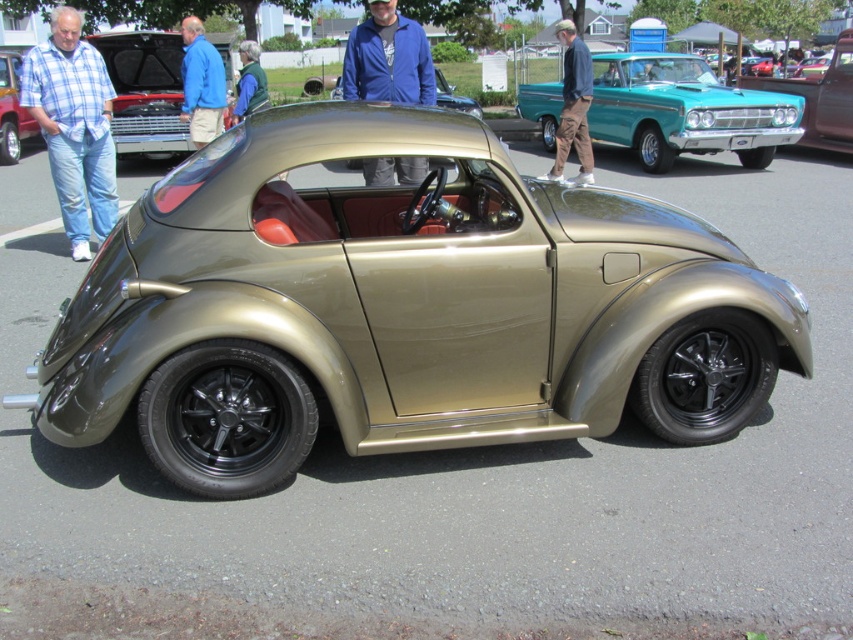
You are standing at the center of the image and want to locate the blue plaid shirt at left. In which direction should you turn your head to see it?

The blue plaid shirt at left is located at point (x=74, y=125), which is to the left side of the image. Therefore, you should turn your head to the left to see it.

You are a photographer at a car show and need to capture both the brown cotton pants at upper center and the blue fabric jacket at upper left in a single frame. Which object should you focus on first to ensure both are in the shot?

You should focus on the brown cotton pants at upper center first because it is larger in size compared to the blue fabric jacket at upper left, ensuring it fits within the frame while adjusting for the smaller jacket.